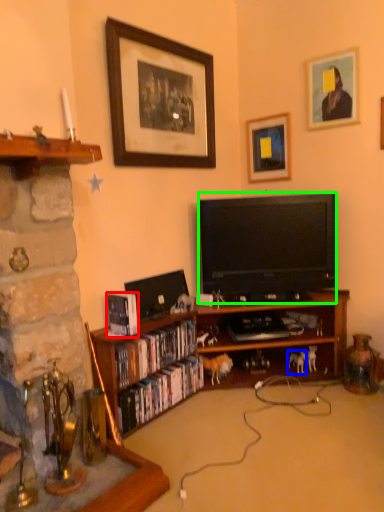
Question: Which is farther away from book (highlighted by a red box)? animal (highlighted by a blue box) or television (highlighted by a green box)?

Choices:
 (A) animal
 (B) television

Answer: (A)